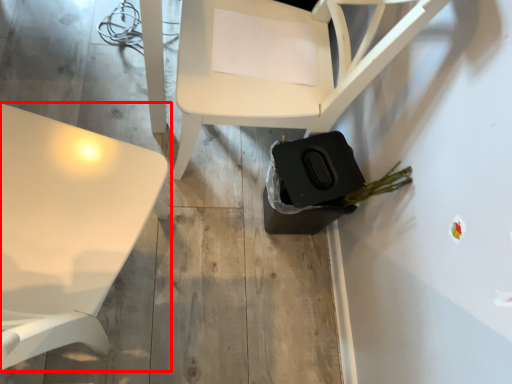
Question: From the image's perspective, what is the correct spatial positioning of table (annotated by the red box) in reference to chair?

Choices:
 (A) above
 (B) below

Answer: (B)